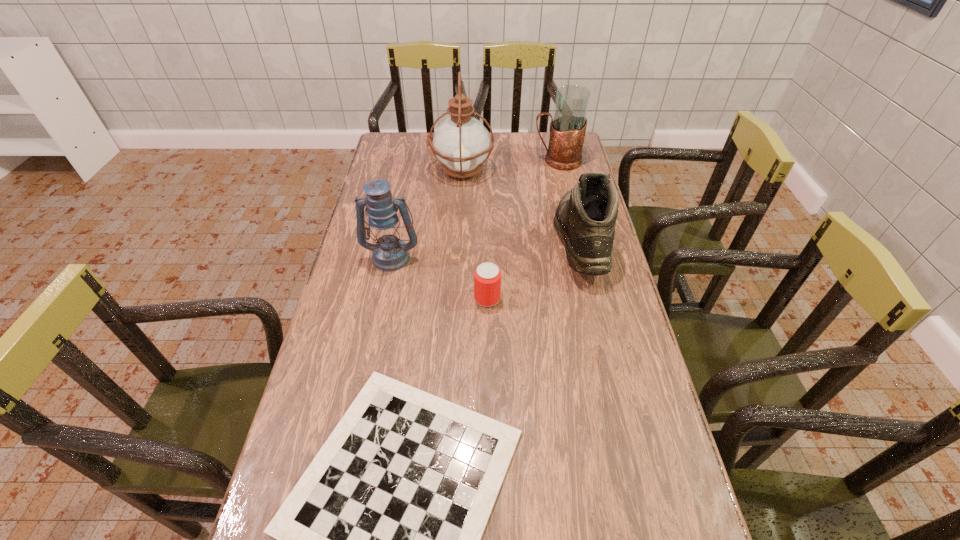
I want to click on free space that satisfies the following two spatial constraints: 1. on the back side of the ski boot; 2. with the handle on the side of the pitcher, so click(562, 160).